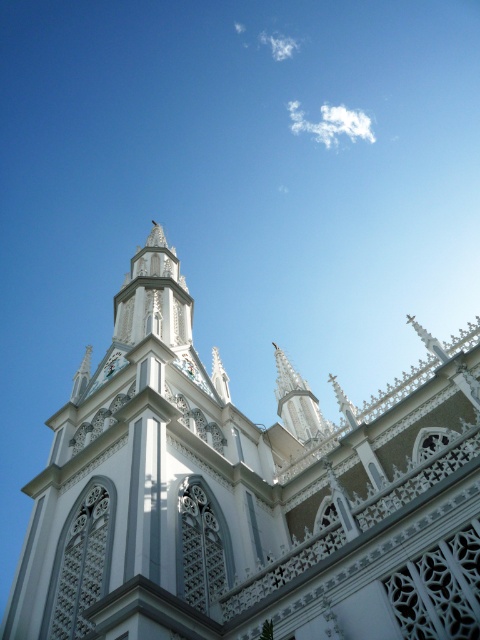
Question: Which object appears farthest from the camera in this image?

Choices:
 (A) white lace-like tower at center
 (B) white lacework church at center

Answer: (A)

Question: From the image, what is the correct spatial relationship of white lacework church at center in relation to white lace-like tower at center?

Choices:
 (A) above
 (B) below

Answer: (A)

Question: Which object appears closest to the camera in this image?

Choices:
 (A) white lacework church at center
 (B) white lace-like tower at center

Answer: (A)

Question: Can you confirm if white lacework church at center is bigger than white lace-like tower at center?

Choices:
 (A) yes
 (B) no

Answer: (A)

Question: Does white lacework church at center have a greater width compared to white lace-like tower at center?

Choices:
 (A) no
 (B) yes

Answer: (B)